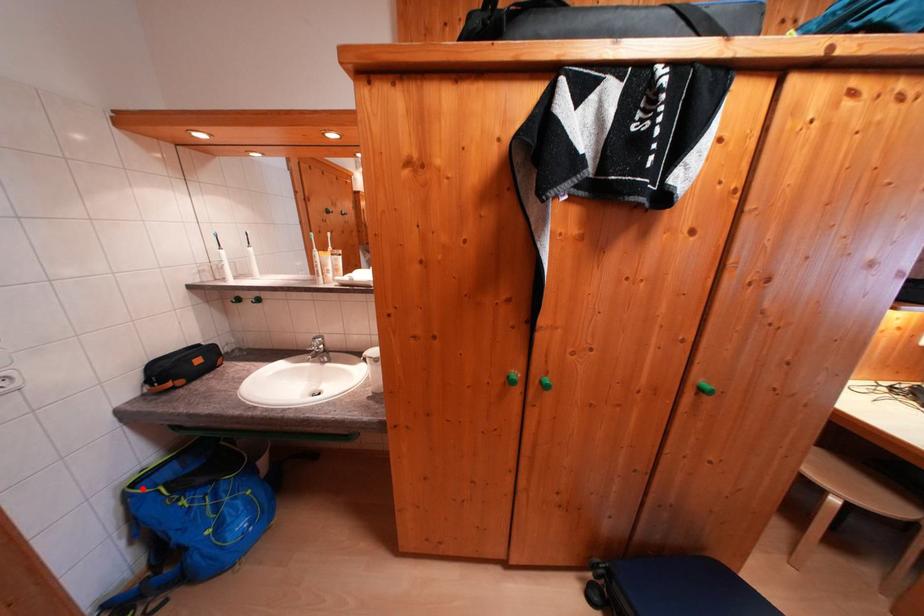
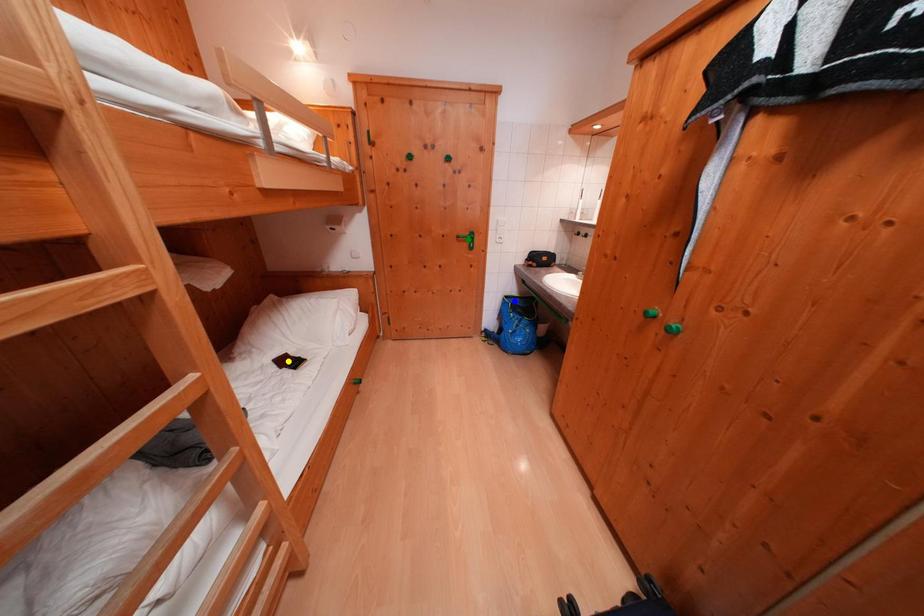
Question: I am providing you with two images of the same scene from different viewpoints. A red point is marked on the first image. You are given multiple points on the second image. Which point in image 2 represents the same 3d spot as the red point in image 1?

Choices:
 (A) yellow point
 (B) green point
 (C) blue point

Answer: (C)